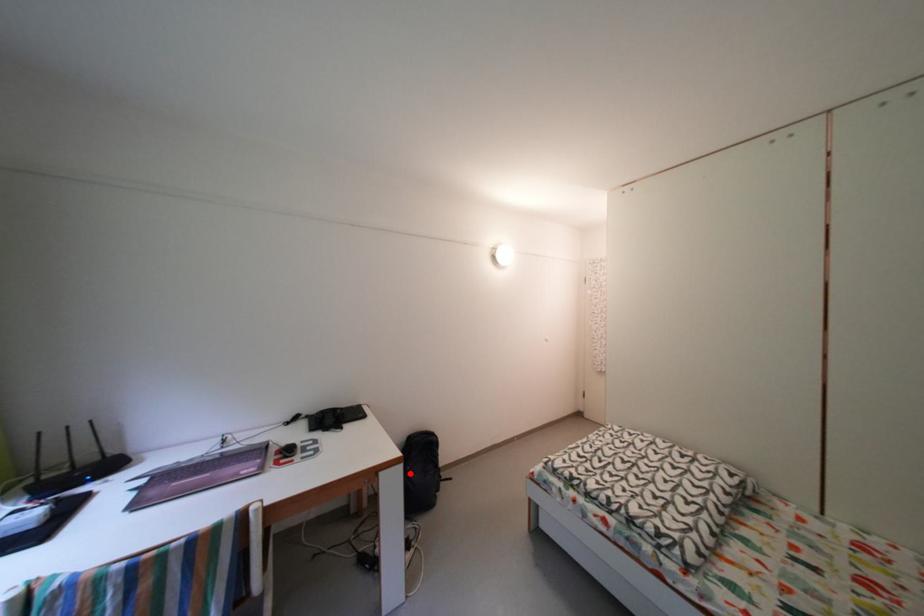
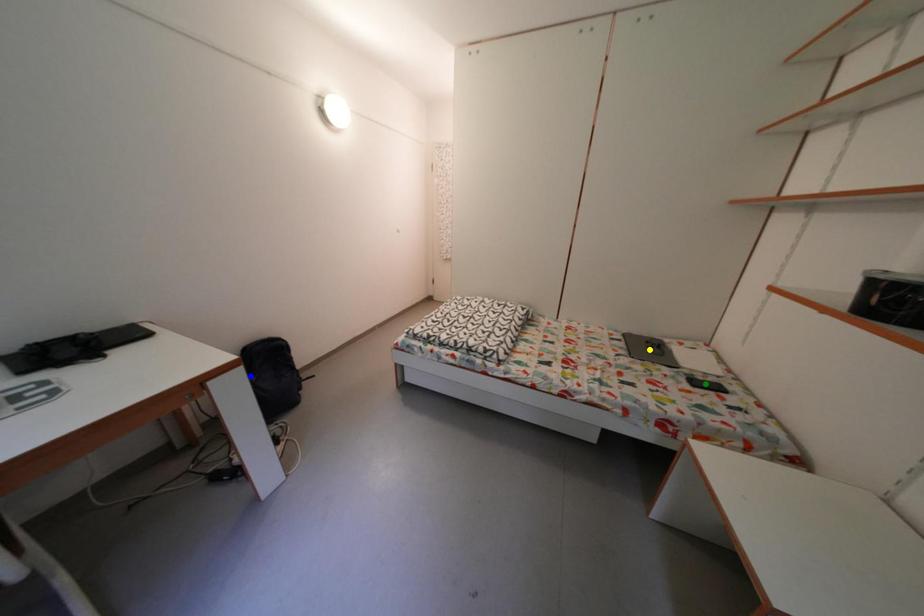
Question: I am providing you with two images of the same scene from different viewpoints. A red point is marked on the first image. You are given multiple points on the second image. Which spot in image 2 lines up with the point in image 1?

Choices:
 (A) green point
 (B) blue point
 (C) yellow point

Answer: (B)